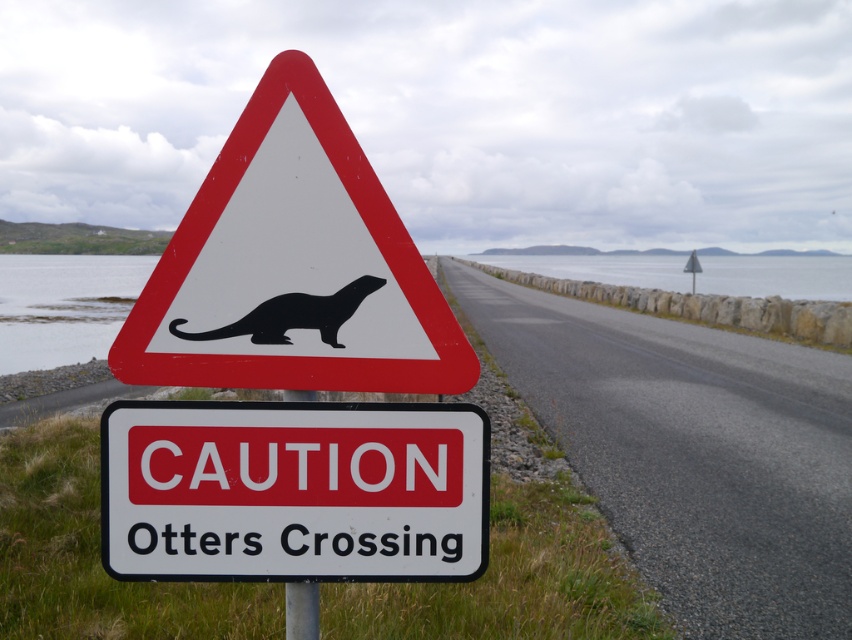
You are driving a car that is 5.5 feet wide. You see the black plastic otter at center on the side of the road. Can your car safely pass through the space between the otter and the nearest road edge without hitting the otter?

The distance between the black plastic otter at center and the camera is 6.15 feet. Since the car is 5.5 feet wide, it can safely pass through the space as the distance is greater than the car width.

You are driving along the coastal road and notice the white plastic sign at center and the metallic pole at center. Which object is taller?

The white plastic sign at center is taller than the metallic pole at center.

You are driving a car that is 1.8 meters wide. You see the black matte otter at center on the road ahead. Can your car safely pass through the space between the otter and the nearest road edge without hitting the otter?

The distance between the black matte otter at center and the camera is 1.95 meters. However, the question requires knowing the distance between the otter and the nearest road edge, which isn not provided in the Objects Description. Therefore, it is impossible to determine if the car can safely pass.